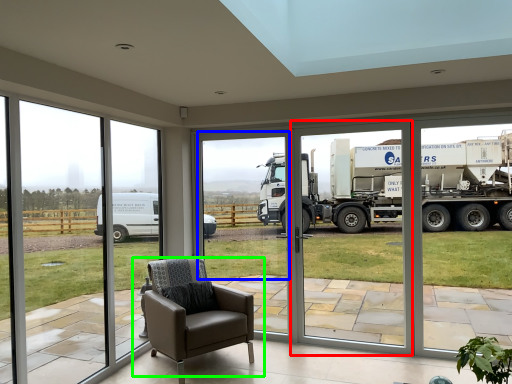
Question: Based on their relative distances, which object is nearer to screen door (highlighted by a red box)? Choose from window screen (highlighted by a blue box) and chair (highlighted by a green box).

Choices:
 (A) window screen
 (B) chair

Answer: (A)